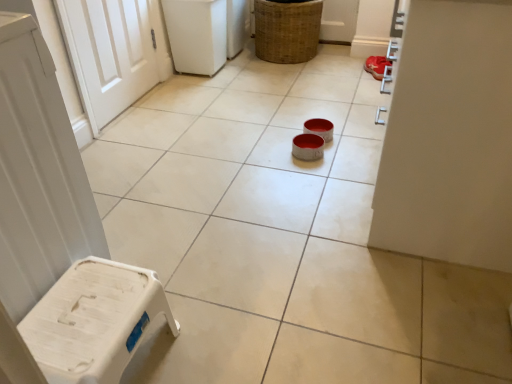
This screenshot has width=512, height=384. In order to click on vacant area that lies between red suede shoe at upper right and woven brown basket at upper center in this screenshot , I will do `click(337, 73)`.